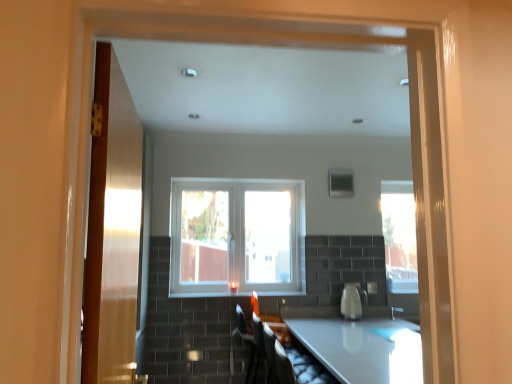
Question: Can you confirm if white plastic window at center is thinner than matte black armchair at lower center, which is the first armchair from front to back?

Choices:
 (A) yes
 (B) no

Answer: (A)

Question: From the image's perspective, does white plastic window at center appear higher than matte black armchair at lower center, which is the first armchair from front to back?

Choices:
 (A) yes
 (B) no

Answer: (A)

Question: Is the position of white plastic window at center less distant than that of matte black armchair at lower center, which is the first armchair from front to back?

Choices:
 (A) yes
 (B) no

Answer: (B)

Question: Is white plastic window at center wider than matte black armchair at lower center, marked as the 2th armchair in a back-to-front arrangement?

Choices:
 (A) no
 (B) yes

Answer: (A)

Question: Does white plastic window at center appear on the right side of matte black armchair at lower center, which is the first armchair from front to back?

Choices:
 (A) no
 (B) yes

Answer: (A)

Question: From the image's perspective, is white glossy kettle at center positioned above or below matte black armchair at lower center, which is the first armchair from front to back?

Choices:
 (A) below
 (B) above

Answer: (B)

Question: Considering the positions of white glossy kettle at center and matte black armchair at lower center, which is the first armchair from front to back, in the image, is white glossy kettle at center taller or shorter than matte black armchair at lower center, which is the first armchair from front to back,?

Choices:
 (A) tall
 (B) short

Answer: (B)

Question: Does point (344, 289) appear closer or farther from the camera than point (310, 382)?

Choices:
 (A) closer
 (B) farther

Answer: (B)

Question: Considering the positions of white glossy kettle at center and matte black armchair at lower center, which is the first armchair from front to back, in the image, is white glossy kettle at center bigger or smaller than matte black armchair at lower center, which is the first armchair from front to back,?

Choices:
 (A) small
 (B) big

Answer: (A)

Question: From a real-world perspective, is white glossy kettle at center positioned above or below matte black armchair at lower center, which appears as the 1th armchair when viewed from the back?

Choices:
 (A) above
 (B) below

Answer: (A)

Question: Is white glossy kettle at center taller or shorter than matte black armchair at lower center, which is the 2th armchair from front to back?

Choices:
 (A) short
 (B) tall

Answer: (A)

Question: Would you say white glossy kettle at center is to the left or to the right of matte black armchair at lower center, which appears as the 1th armchair when viewed from the back, in the picture?

Choices:
 (A) right
 (B) left

Answer: (A)

Question: Does point (355, 289) appear closer or farther from the camera than point (276, 329)?

Choices:
 (A) farther
 (B) closer

Answer: (A)

Question: Considering the positions of matte black armchair at lower center, which appears as the 1th armchair when viewed from the back, and matte black armchair at lower center, marked as the 2th armchair in a back-to-front arrangement, in the image, is matte black armchair at lower center, which appears as the 1th armchair when viewed from the back, taller or shorter than matte black armchair at lower center, marked as the 2th armchair in a back-to-front arrangement,?

Choices:
 (A) tall
 (B) short

Answer: (A)

Question: Is matte black armchair at lower center, which appears as the 1th armchair when viewed from the back, wider or thinner than matte black armchair at lower center, marked as the 2th armchair in a back-to-front arrangement?

Choices:
 (A) thin
 (B) wide

Answer: (A)